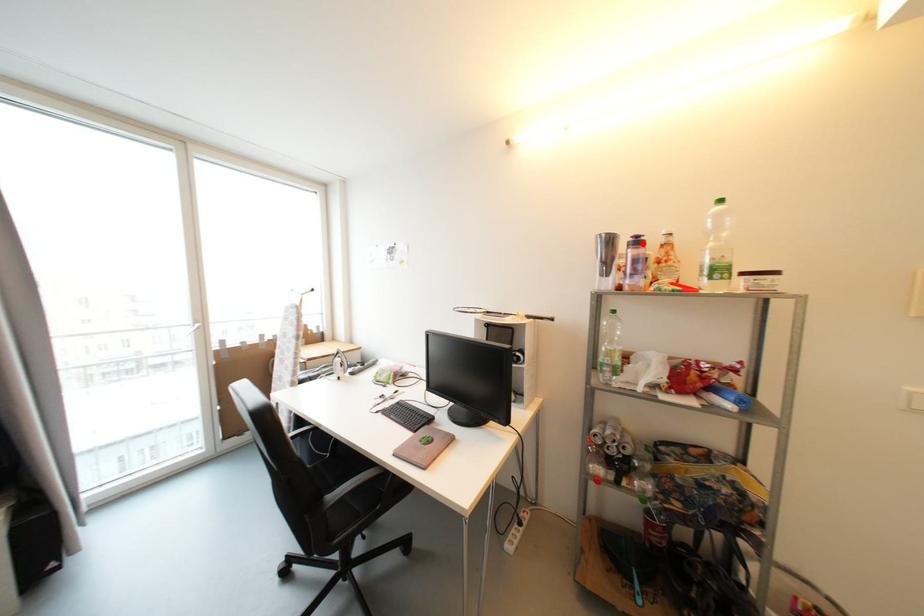
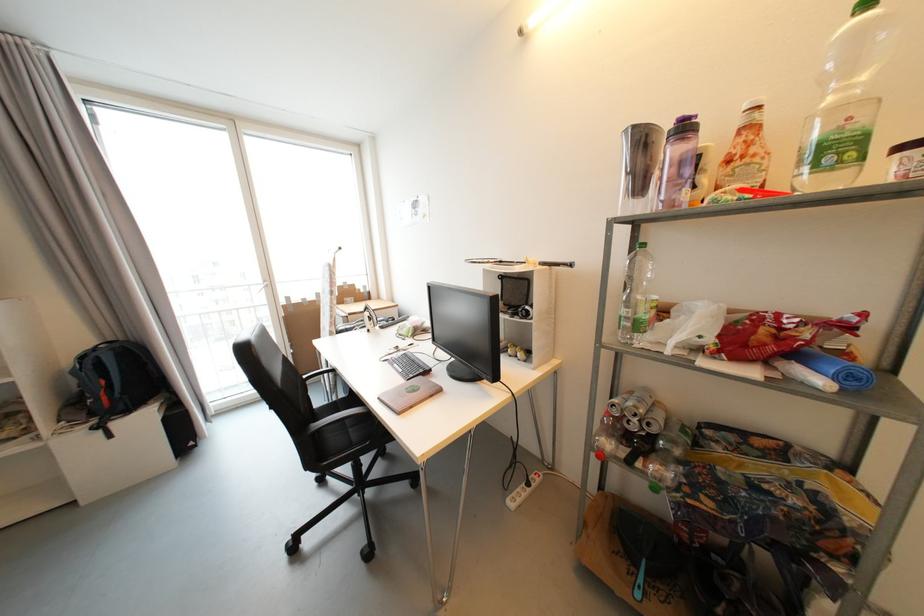
Locate, in the second image, the point that corresponds to the highlighted location in the first image.

(689, 130)